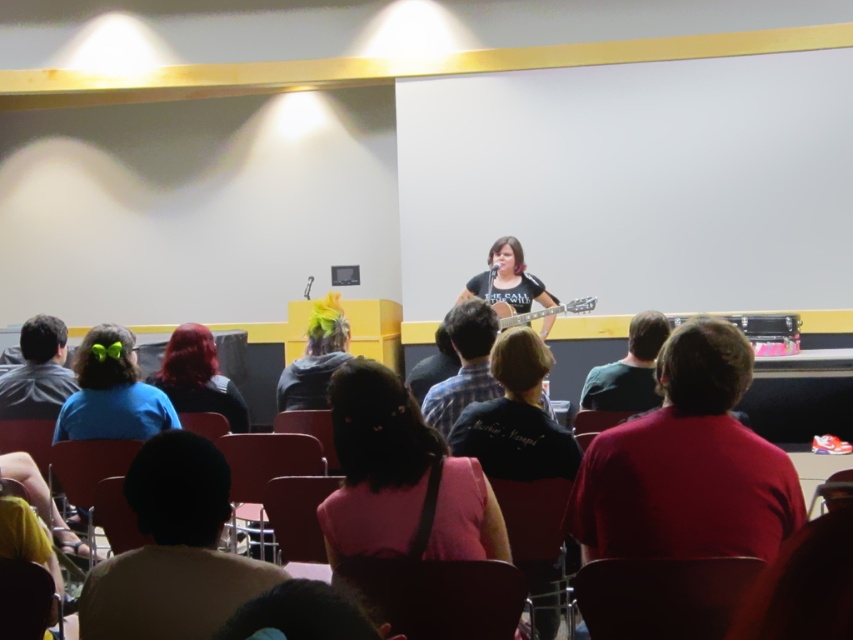
Is gray hoodie at left to the left of neon yellow hair at center from the viewer's perspective?

Correct, you'll find gray hoodie at left to the left of neon yellow hair at center.

Can you confirm if gray hoodie at left is positioned above neon yellow hair at center?

No.

Between point (56, 372) and point (347, 326), which one is positioned in front?

Positioned in front is point (56, 372).

At what (x,y) coordinates should I click in order to perform the action: click on gray hoodie at left. Please return your answer as a coordinate pair (x, y). Looking at the image, I should click on (38, 372).

Can you confirm if shiny red hair at lower left is bigger than green matte shirt at center?

Yes, shiny red hair at lower left is bigger than green matte shirt at center.

Can you confirm if shiny red hair at lower left is shorter than green matte shirt at center?

No, shiny red hair at lower left is not shorter than green matte shirt at center.

Is point (213, 352) positioned in front of point (631, 372)?

No, (213, 352) is behind (631, 372).

Locate an element on the screen. The image size is (853, 640). shiny red hair at lower left is located at coordinates (198, 378).

Is pink fabric shirt at lower left above green matte shirt at center?

No.

Is pink fabric shirt at lower left further to the viewer compared to green matte shirt at center?

No.

Does point (103, 579) come closer to viewer compared to point (608, 365)?

Yes, point (103, 579) is closer to viewer.

Identify the location of pink fabric shirt at lower left. (173, 550).